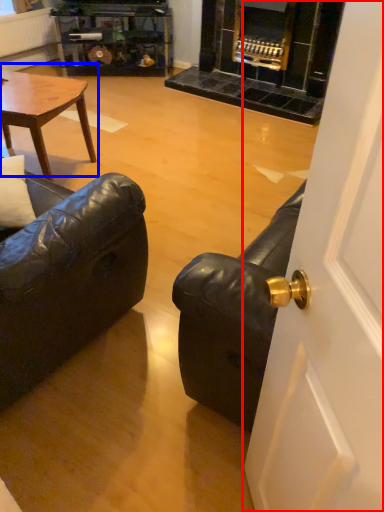
Question: Among these objects, which one is nearest to the camera, door (highlighted by a red box) or coffee table (highlighted by a blue box)?

Choices:
 (A) door
 (B) coffee table

Answer: (A)